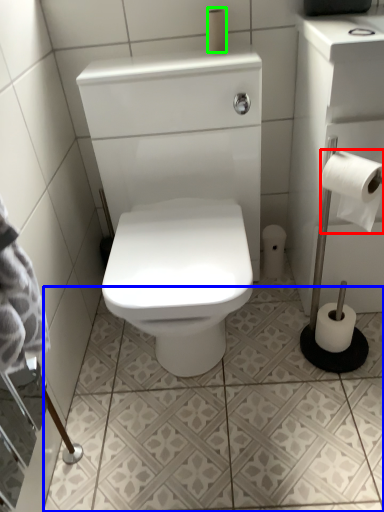
Question: Considering the real-world distances, which object is farthest from toilet paper (highlighted by a red box)? ceramic tile (highlighted by a blue box) or toilet paper (highlighted by a green box)?

Choices:
 (A) ceramic tile
 (B) toilet paper

Answer: (A)